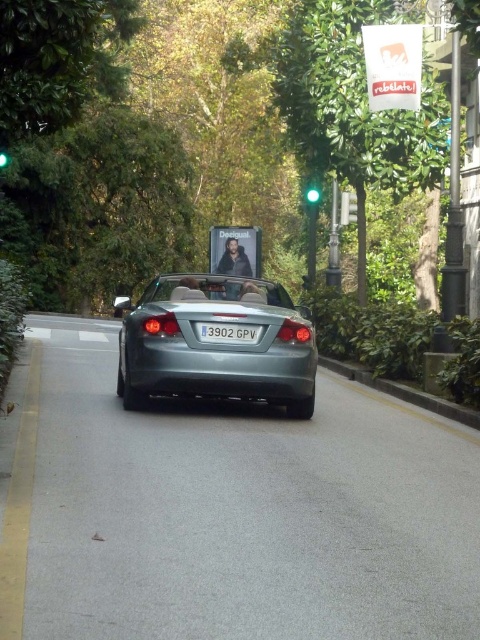
You are a driver approaching the green glass traffic light at upper center and the green glass traffic light at center. Which traffic light is wider?

The green glass traffic light at upper center is wider than the green glass traffic light at center.

You are a photographer trying to capture the satin silver convertible at center and the green glass traffic light at upper center in a single frame. Given their sizes, which object will appear bigger in your photo?

The satin silver convertible at center will appear bigger in the photo because it has a larger size compared to the green glass traffic light at upper center.

You are a drone operator trying to capture aerial footage of the convertible car. You need to position your drone between two points to get the best shot. The points are point [345,196] and point [315,186]. Which point should the drone be closer to in order to stay ahead of the car as it moves forward?

The drone should be closer to point [345,196] because it is in front of point [315,186], so staying near it will keep the drone ahead of the car as it moves forward.